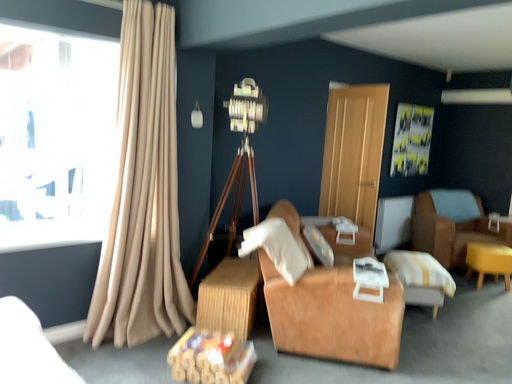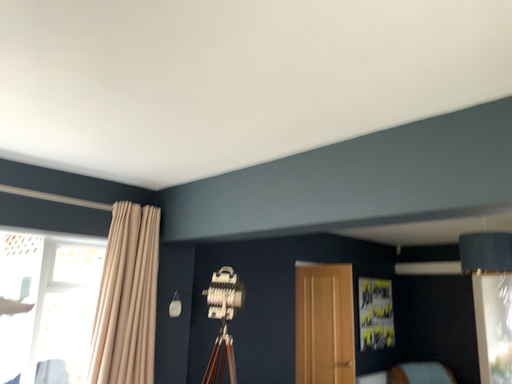
Question: Which way did the camera rotate in the video?

Choices:
 (A) rotated upward
 (B) rotated downward

Answer: (A)